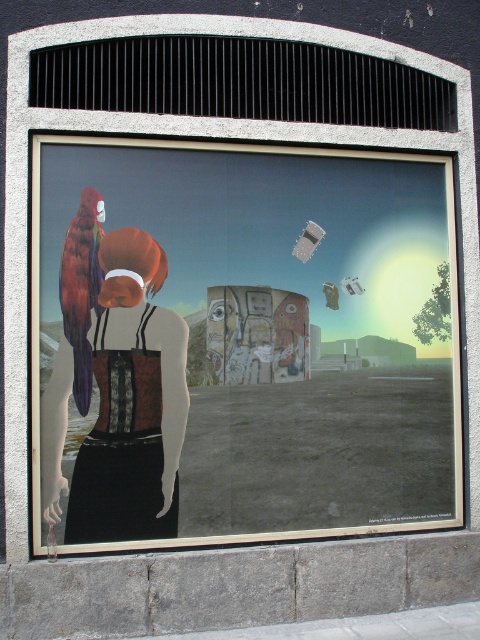
Measure the distance between matte black corset at center and camera.

The distance of matte black corset at center from camera is 4.62 meters.

Which is behind, point (143, 429) or point (84, 243)?

Positioned behind is point (84, 243).

Between point (158, 356) and point (75, 237), which one is positioned behind?

Positioned behind is point (158, 356).

Find the location of a particular element. The image size is (480, 640). matte black corset at center is located at coordinates (132, 403).

What do you see at coordinates (256, 333) in the screenshot?
I see `wooden painted mask at center` at bounding box center [256, 333].

Is point (207, 330) farther from viewer compared to point (75, 324)?

Yes.

Find the location of a particular element. Image resolution: width=480 pixels, height=640 pixels. wooden painted mask at center is located at coordinates (256, 333).

Can you confirm if matte black poster at center is positioned above matte black corset at center?

Yes, matte black poster at center is above matte black corset at center.

Between matte black poster at center and matte black corset at center, which one has less height?

With less height is matte black corset at center.

Image resolution: width=480 pixels, height=640 pixels. Describe the element at coordinates (240, 342) in the screenshot. I see `matte black poster at center` at that location.

Identify the location of matte black poster at center. (240, 342).